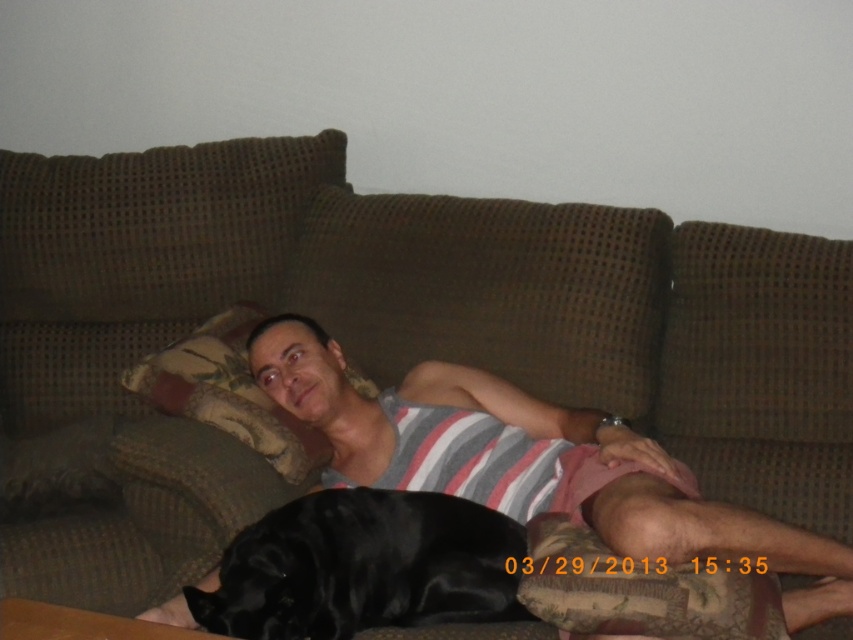
Question: Does striped fabric tank top at center have a larger size compared to shiny black dog at lower left?

Choices:
 (A) no
 (B) yes

Answer: (B)

Question: Is striped fabric tank top at center positioned in front of shiny black dog at lower left?

Choices:
 (A) no
 (B) yes

Answer: (A)

Question: Which of these objects is positioned closest to the striped fabric tank top at center?

Choices:
 (A) brown textured pillow at upper left
 (B) shiny black dog at lower left

Answer: (A)

Question: Estimate the real-world distances between objects in this image. Which object is closer to the shiny black dog at lower left?

Choices:
 (A) brown textured pillow at upper left
 (B) striped fabric tank top at center

Answer: (B)

Question: Is the position of striped fabric tank top at center more distant than that of shiny black dog at lower left?

Choices:
 (A) yes
 (B) no

Answer: (A)

Question: Among these objects, which one is farthest from the camera?

Choices:
 (A) shiny black dog at lower left
 (B) striped fabric tank top at center

Answer: (B)